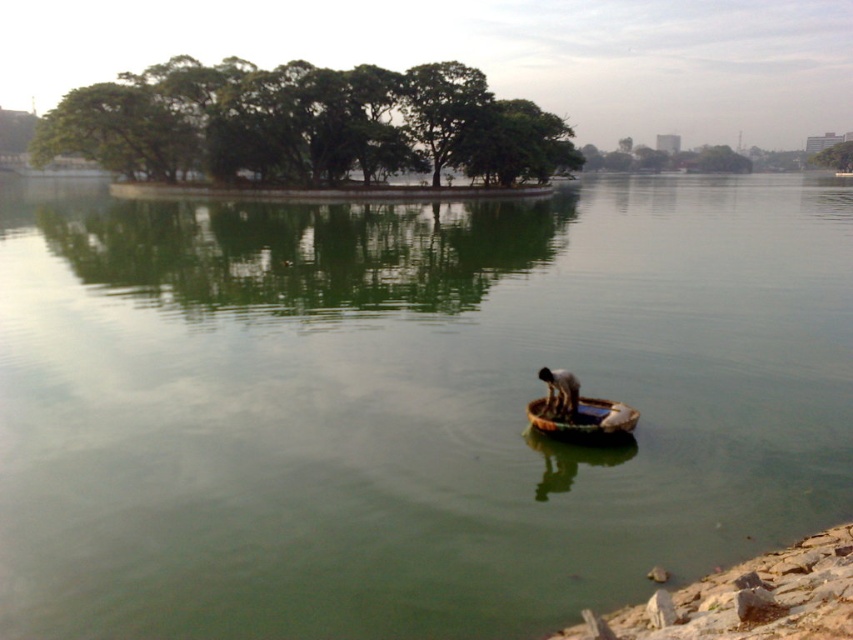
Does point (566, 422) come behind point (573, 376)?

No, (566, 422) is in front of (573, 376).

Which is in front, point (572, 440) or point (567, 412)?

Point (572, 440)

Locate an element on the screen. The width and height of the screenshot is (853, 640). brown woven canoe at center is located at coordinates (584, 420).

Is green smooth water at center bigger than brown woven canoe at center?

Indeed, green smooth water at center has a larger size compared to brown woven canoe at center.

Based on the photo, who is higher up, green smooth water at center or brown woven canoe at center?

green smooth water at center is above.

Identify the location of green smooth water at center. tap(407, 403).

The image size is (853, 640). Find the location of `green smooth water at center`. green smooth water at center is located at coordinates (407, 403).

Between green smooth water at center and brown woven basket at center, which one has less height?

With less height is brown woven basket at center.

Is point (624, 515) positioned before point (567, 412)?

Yes, point (624, 515) is closer to viewer.

Locate an element on the screen. green smooth water at center is located at coordinates (407, 403).